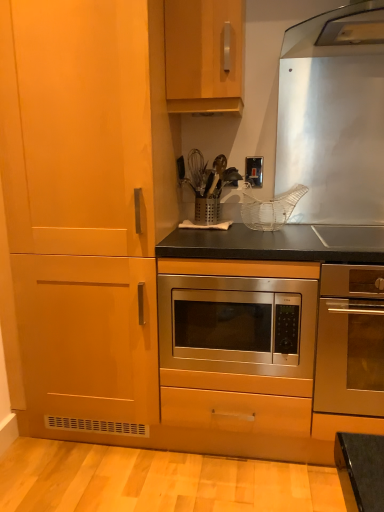
Question: Does point (286, 354) appear closer or farther from the camera than point (8, 187)?

Choices:
 (A) closer
 (B) farther

Answer: (A)

Question: Considering the relative positions of stainless steel microwave at center, which is the 2th oven in right-to-left order, and matte wood cabinet at left, marked as the 2th cabinetry in a right-to-left arrangement, in the image provided, is stainless steel microwave at center, which is the 2th oven in right-to-left order, to the left or to the right of matte wood cabinet at left, marked as the 2th cabinetry in a right-to-left arrangement,?

Choices:
 (A) right
 (B) left

Answer: (A)

Question: Considering the real-world distances, which object is farthest from the wooden cabinet at upper center, marked as the first cabinetry in a right-to-left arrangement?

Choices:
 (A) stainless steel microwave at center, which is the 2th oven in right-to-left order
 (B) matte wood cabinet at left, the first cabinetry positioned from the left
 (C) stainless steel oven at center, which is counted as the 1th oven, starting from the right
 (D) satin silver switch at upper center

Answer: (C)

Question: Which is farther from the wooden cabinet at upper center, marked as the first cabinetry in a right-to-left arrangement?

Choices:
 (A) stainless steel oven at center, arranged as the second oven when viewed from the left
 (B) stainless steel microwave at center, which is the 2th oven in right-to-left order
 (C) matte wood cabinet at left, marked as the 2th cabinetry in a right-to-left arrangement
 (D) satin silver switch at upper center

Answer: (A)